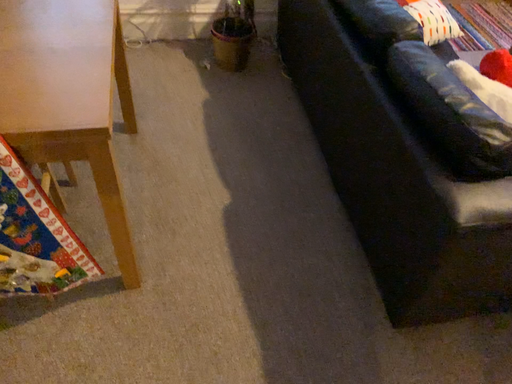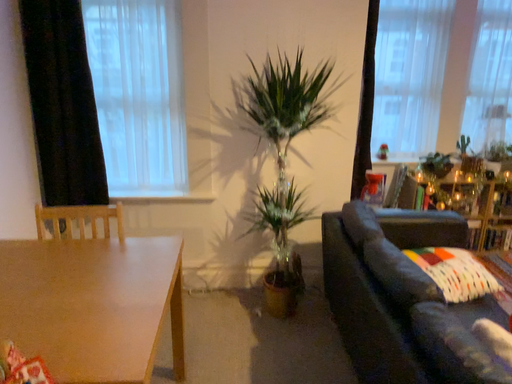
Question: Which way did the camera rotate in the video?

Choices:
 (A) rotated downward
 (B) rotated upward

Answer: (B)